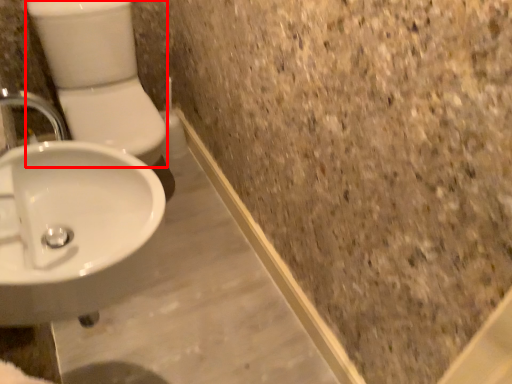
Question: From the image's perspective, what is the correct spatial relationship of toilet bowl (annotated by the red box) in relation to sink?

Choices:
 (A) below
 (B) above

Answer: (B)